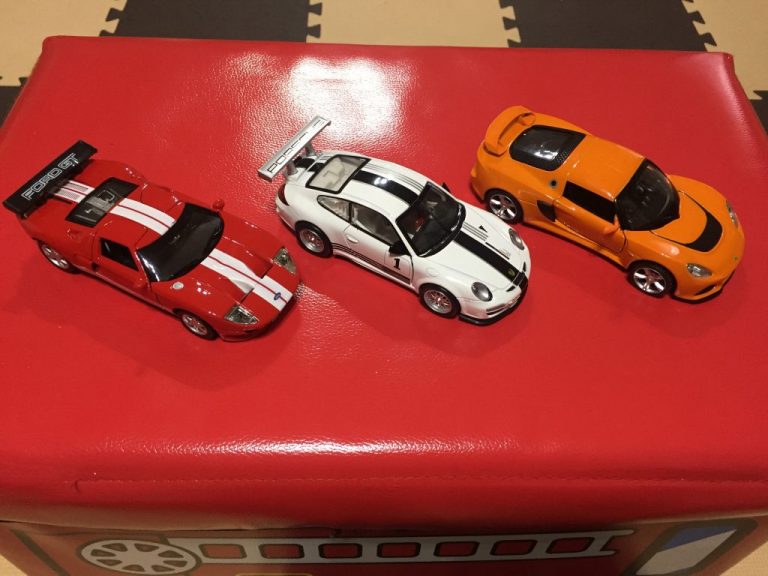
At what (x,y) coordinates should I click in order to perform the action: click on door handle. Please return your answer as a coordinate pair (x, y). The image size is (768, 576). Looking at the image, I should click on (98, 262), (348, 238).